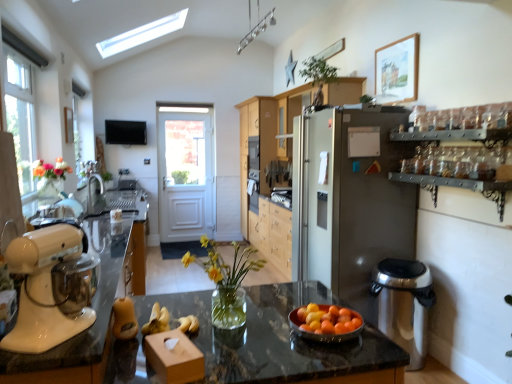
At what (x,y) coordinates should I click in order to perform the action: click on vacant area in front of orange matte bowl at center. Please return your answer as a coordinate pair (x, y). The width and height of the screenshot is (512, 384). Looking at the image, I should click on (326, 356).